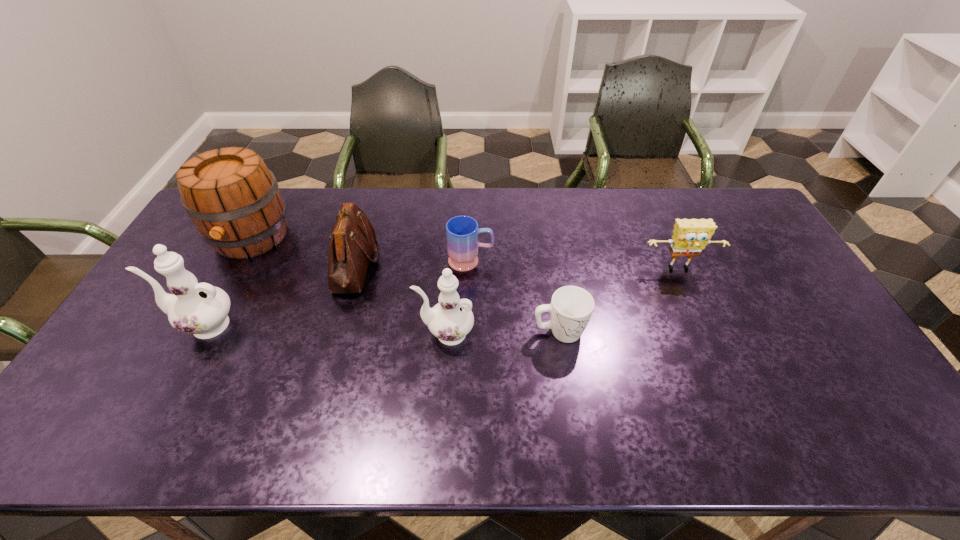
The height and width of the screenshot is (540, 960). What are the coordinates of `vacant point located between the cider and the nearer mug` in the screenshot? It's located at (405, 285).

Identify the location of vacant space that's between the right mug and the fifth tallest object. The image size is (960, 540). (619, 300).

Identify the location of free space that is in between the second object from right to left and the rightmost object. This screenshot has width=960, height=540. (619, 300).

This screenshot has width=960, height=540. What are the coordinates of `vacant point located between the taller chinaware and the cider` in the screenshot? It's located at (228, 281).

Choose which object is the nearest neighbor to the rightmost object. Please provide its 2D coordinates. Your answer should be formatted as a tuple, i.e. [(x, y)], where the tuple contains the x and y coordinates of a point satisfying the conditions above.

[(571, 307)]

The width and height of the screenshot is (960, 540). In order to click on object that is the fourth nearest to the taller chinaware in this screenshot , I will do `click(462, 232)`.